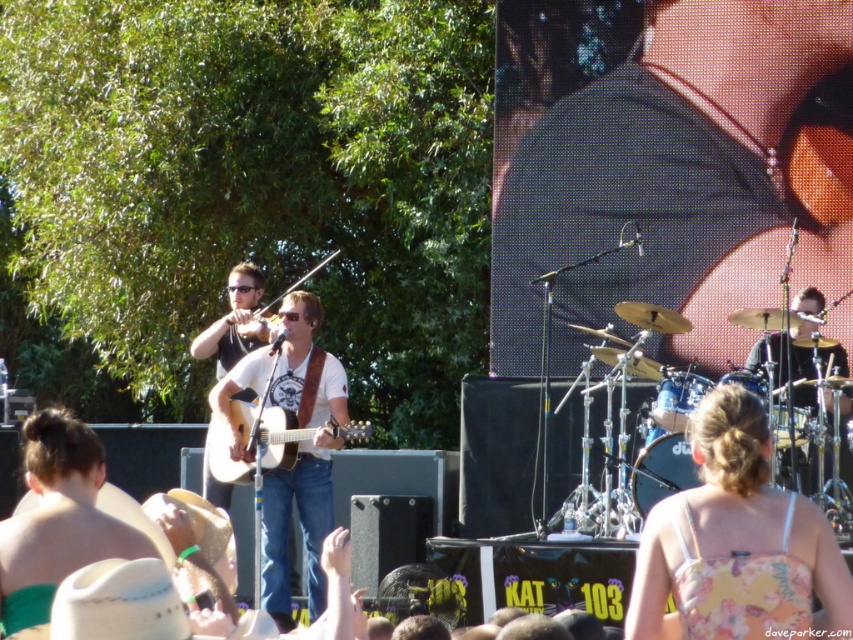
You are at the concert and want to take a photo of both the white matte guitar at center and the light wood acoustic guitar at center. Which guitar should you position to your left to include both in the frame?

You should position the light wood acoustic guitar at center to your left because the white matte guitar at center is to the right of it, ensuring both guitars are captured in the photo.

You are a photographer at the concert and want to capture both the white matte guitar at center and the black drum set at right in a single shot. Given that your camera has a fixed focal length, which object should you position closer to the camera to ensure both are in focus?

The white matte guitar at center is larger in size than the black drum set at right. To ensure both are in focus, you should position the larger white matte guitar at center closer to the camera since larger objects may require being nearer to maintain focus balance between them.